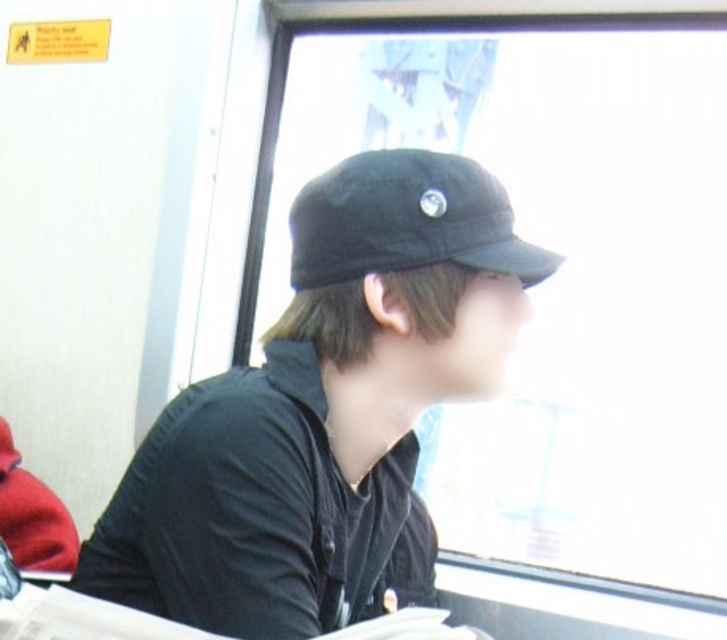
Does transparent glass window at center have a lesser height compared to black matte cap at center?

No.

Is point (582, 236) positioned before point (361, 577)?

That is False.

Where is `transparent glass window at center`? transparent glass window at center is located at coordinates (550, 288).

In the scene shown: Between black matte cap at center and black matte baseball cap at upper center, which one has less height?

black matte baseball cap at upper center is shorter.

Where is `black matte cap at center`? This screenshot has height=640, width=727. black matte cap at center is located at coordinates (321, 406).

Where is `black matte cap at center`? This screenshot has height=640, width=727. black matte cap at center is located at coordinates (321, 406).

Is transparent glass window at center to the right of black matte baseball cap at upper center from the viewer's perspective?

Yes, transparent glass window at center is to the right of black matte baseball cap at upper center.

Where is `transparent glass window at center`? The height and width of the screenshot is (640, 727). transparent glass window at center is located at coordinates (550, 288).

You are a GUI agent. You are given a task and a screenshot of the screen. Output one action in this format:
    pyautogui.click(x=<x>, y=<y>)
    Task: Click on the transparent glass window at center
    The width and height of the screenshot is (727, 640).
    Given the screenshot: What is the action you would take?
    pyautogui.click(x=550, y=288)